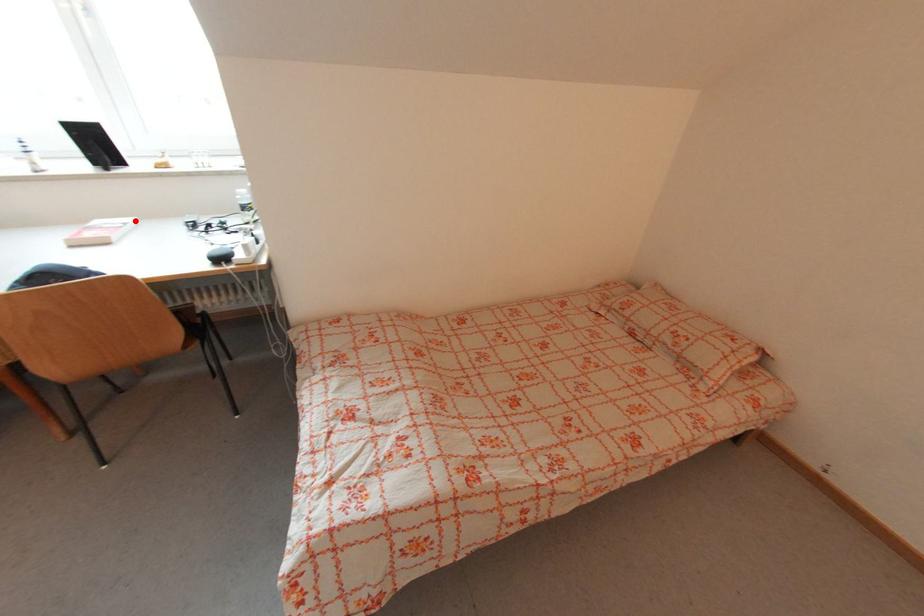
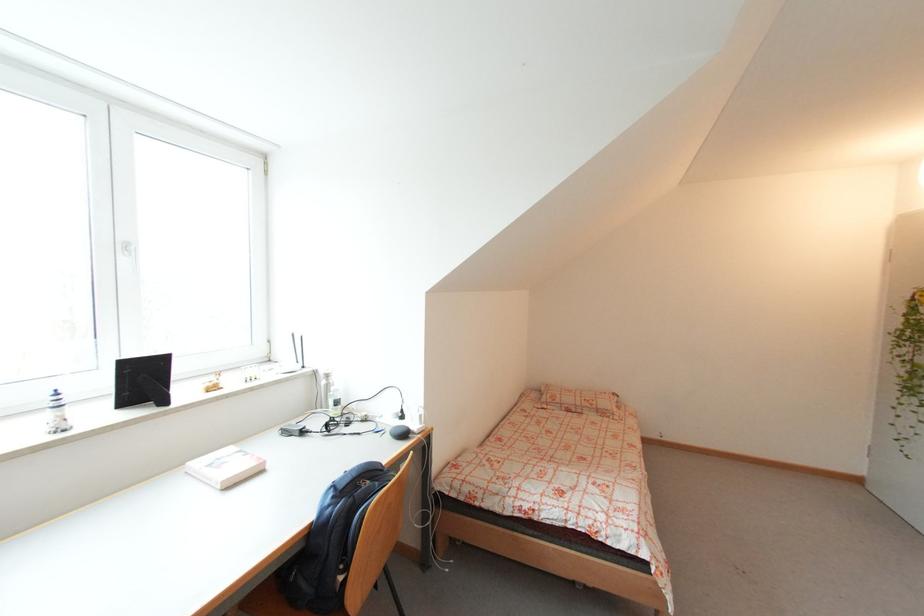
Find the pixel in the second image that matches the highlighted location in the first image.

(236, 450)